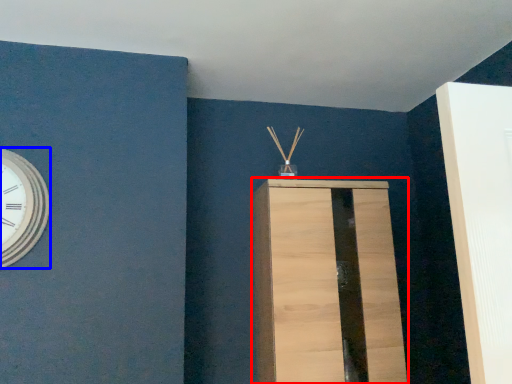
Question: Which object is further to the camera taking this photo, furniture (highlighted by a red box) or wall clock (highlighted by a blue box)?

Choices:
 (A) furniture
 (B) wall clock

Answer: (A)